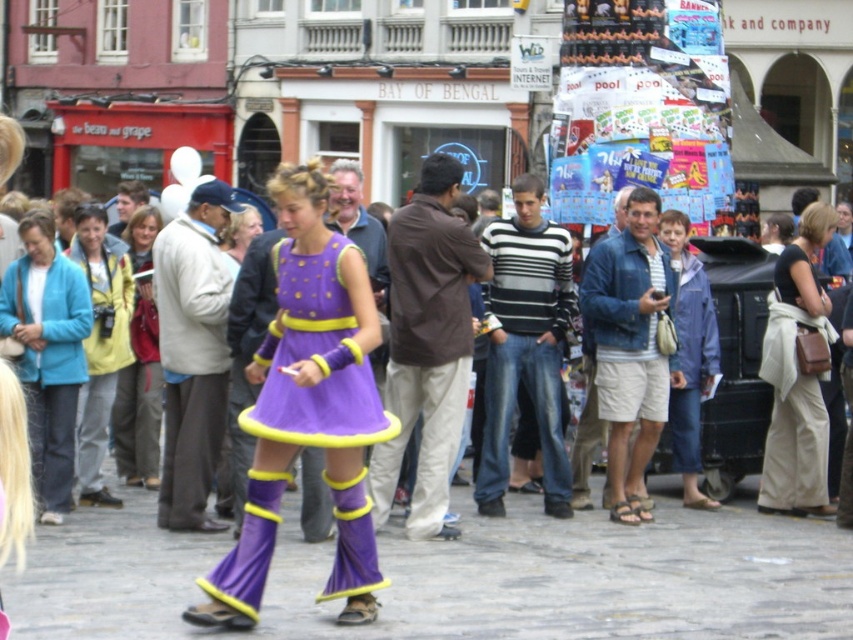
Does purple matte dress at center come behind light beige sweater at center?

No.

Is point (234, 627) farther from viewer compared to point (206, 332)?

No, it is not.

Is point (315, 292) more distant than point (195, 317)?

That is False.

This screenshot has width=853, height=640. In order to click on purple matte dress at center in this screenshot , I will do `click(308, 408)`.

Does striped sweater at center have a larger size compared to light brown leather jacket at center?

Actually, striped sweater at center might be smaller than light brown leather jacket at center.

At what (x,y) coordinates should I click in order to perform the action: click on striped sweater at center. Please return your answer as a coordinate pair (x, y). The width and height of the screenshot is (853, 640). Looking at the image, I should click on (526, 344).

What do you see at coordinates (526, 344) in the screenshot? The height and width of the screenshot is (640, 853). I see `striped sweater at center` at bounding box center [526, 344].

The image size is (853, 640). In order to click on striped sweater at center in this screenshot , I will do `click(526, 344)`.

Which is in front, point (352, 481) or point (643, 458)?

Point (352, 481)

Can you confirm if purple matte dress at center is wider than denim jacket at center?

Indeed, purple matte dress at center has a greater width compared to denim jacket at center.

Measure the distance between purple matte dress at center and camera.

purple matte dress at center is 18.88 meters away from camera.

At what (x,y) coordinates should I click in order to perform the action: click on purple matte dress at center. Please return your answer as a coordinate pair (x, y). Looking at the image, I should click on coord(308,408).